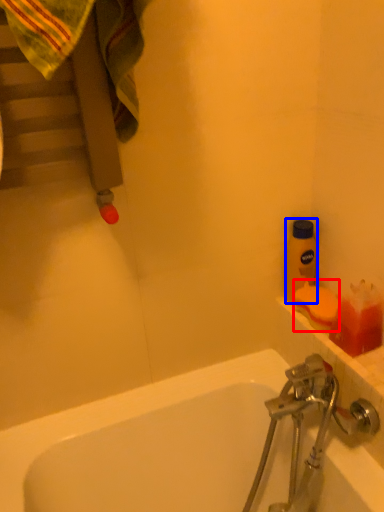
Question: Which of the following is the farthest to the observer, soap (highlighted by a red box) or bottle (highlighted by a blue box)?

Choices:
 (A) soap
 (B) bottle

Answer: (B)